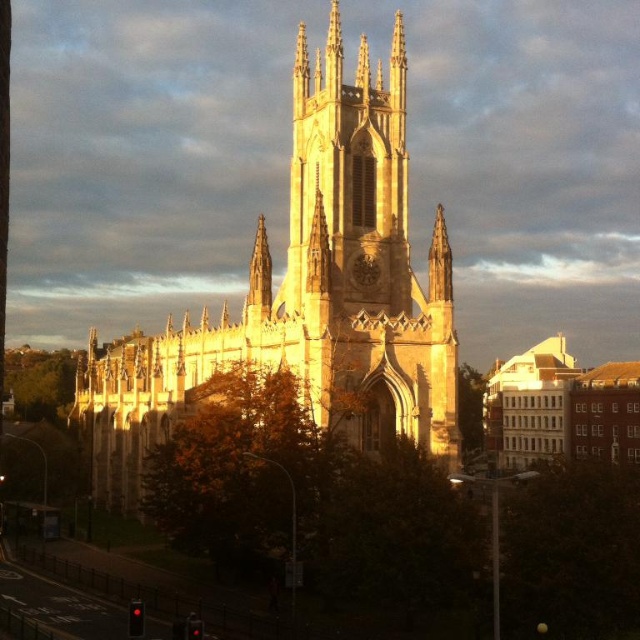
Question: Does golden stone church at center have a lesser width compared to light brown stone church at center?

Choices:
 (A) no
 (B) yes

Answer: (A)

Question: Is golden stone church at center wider than light brown stone church at center?

Choices:
 (A) yes
 (B) no

Answer: (A)

Question: Observing the image, what is the correct spatial positioning of golden stone church at center in reference to light brown stone church at center?

Choices:
 (A) above
 (B) below

Answer: (A)

Question: Which object appears farthest from the camera in this image?

Choices:
 (A) light brown stone church at center
 (B) golden stone church at center

Answer: (A)

Question: Which point appears farthest from the camera in this image?

Choices:
 (A) (182, 356)
 (B) (513, 456)

Answer: (B)